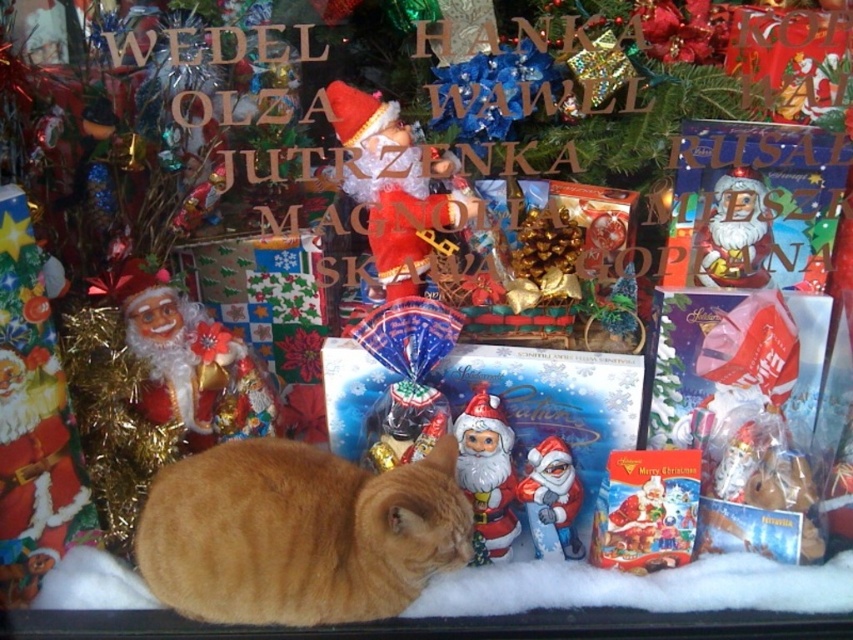
Question: Which point is farther from the camera taking this photo?

Choices:
 (A) (492, 637)
 (B) (368, 593)
 (C) (635, 525)

Answer: (C)

Question: Does orange fur cat at lower center appear on the left side of matte cardboard box at center?

Choices:
 (A) yes
 (B) no

Answer: (A)

Question: Which point is closer to the camera?

Choices:
 (A) (605, 470)
 (B) (624, 612)
 (C) (430, 568)

Answer: (C)

Question: Does black glass at lower center appear on the right side of matte cardboard box at center?

Choices:
 (A) no
 (B) yes

Answer: (A)

Question: Which of the following is the closest to the observer?

Choices:
 (A) matte cardboard box at center
 (B) orange fur cat at lower center
 (C) black glass at lower center

Answer: (B)

Question: In this image, where is black glass at lower center located relative to matte cardboard box at center?

Choices:
 (A) right
 (B) left

Answer: (B)